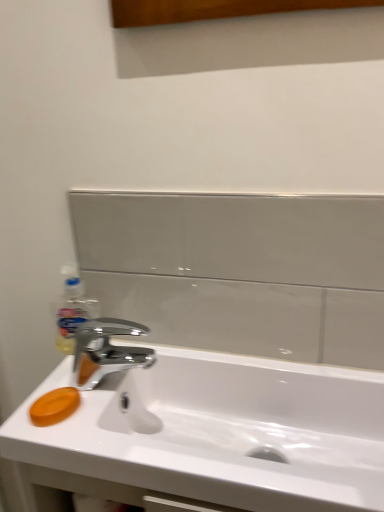
Locate an element on the screen. The image size is (384, 512). blank space situated above white glossy sink at center (from a real-world perspective) is located at coordinates tap(208, 362).